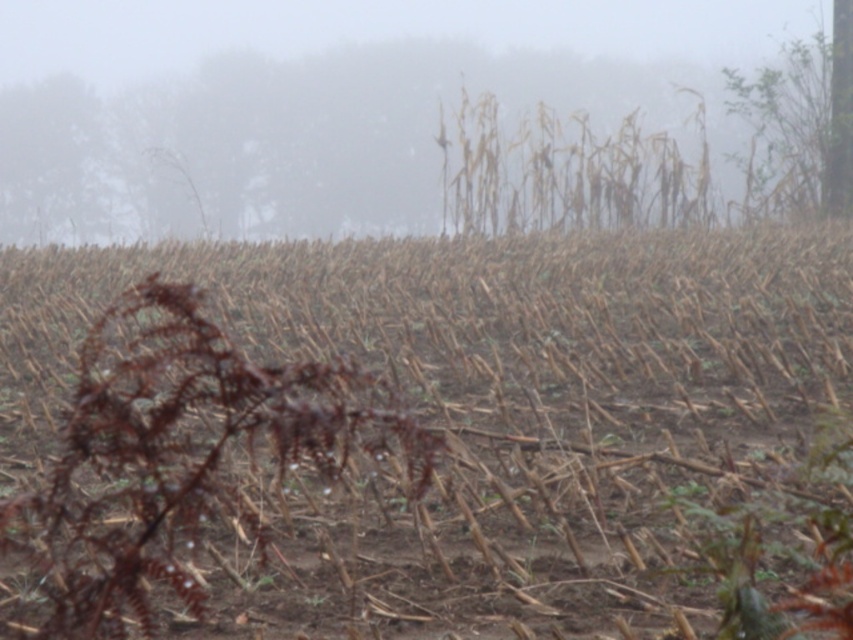
You are a farmer checking the field after harvest. You notice the brown dry stalks at center and the foggy haze at upper center. Which object is closer to you?

The brown dry stalks at center are closer to you because they are positioned in front of the foggy haze at upper center.

You are a farmer planning to plant new crops in the field. You need to know the distance between the brown dry stalks at center and the foggy haze at upper center to determine where to place irrigation equipment. Is the distance sufficient for placing the equipment?

The brown dry stalks at center and foggy haze at upper center are 27.81 meters apart from each other. This distance may be sufficient for placing irrigation equipment, but further details about the equipment requirements are needed to confirm.

You are a farmer assessing the harvested field. You notice the brown dry stalks at center and the foggy haze at upper center. Which object is closer to the ground?

The brown dry stalks at center are closer to the ground than the foggy haze at upper center because they are shorter in height.